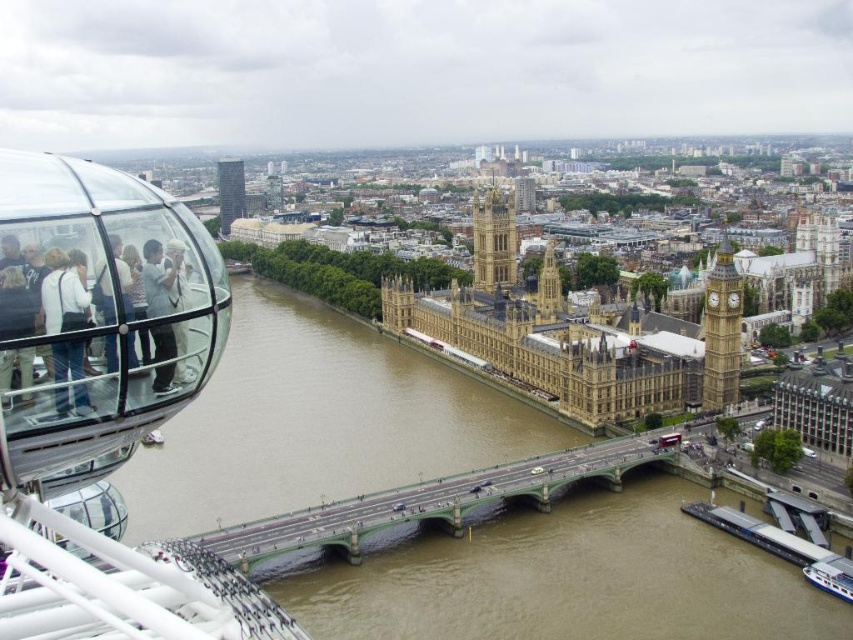
You are a tourist standing at the London Eye and want to take a photo of the green metallic bridge at center. Based on your current position, is the bridge located to your left, right, or directly in front of you?

The green metallic bridge at center is located directly in front of you because its 2D coordinates are at the center of the image, which corresponds to your line of sight when standing at the London Eye.

You are a tourist standing at the Houses of Parliament. You want to take a photo of the green metallic bridge at center and the light gray fabric people at left. Can you fit both in your camera frame if your camera can capture a maximum distance of 100 meters between the closest and farthest objects?

The green metallic bridge at center is 88.31 meters away from the light gray fabric people at left. Since the camera can capture up to 100 meters between objects, both can be included in the photo as the distance is within the camera range.